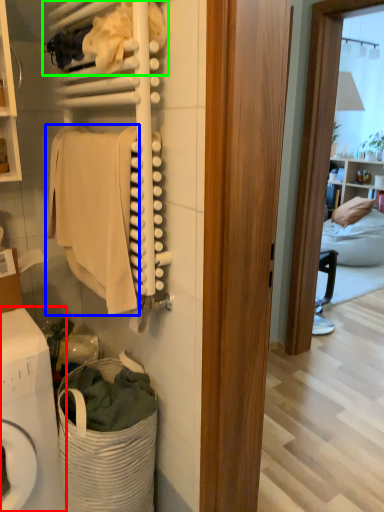
Question: Which object is positioned closest to washing machine (highlighted by a red box)? Select from clothing (highlighted by a blue box) and laundry (highlighted by a green box).

Choices:
 (A) clothing
 (B) laundry

Answer: (A)